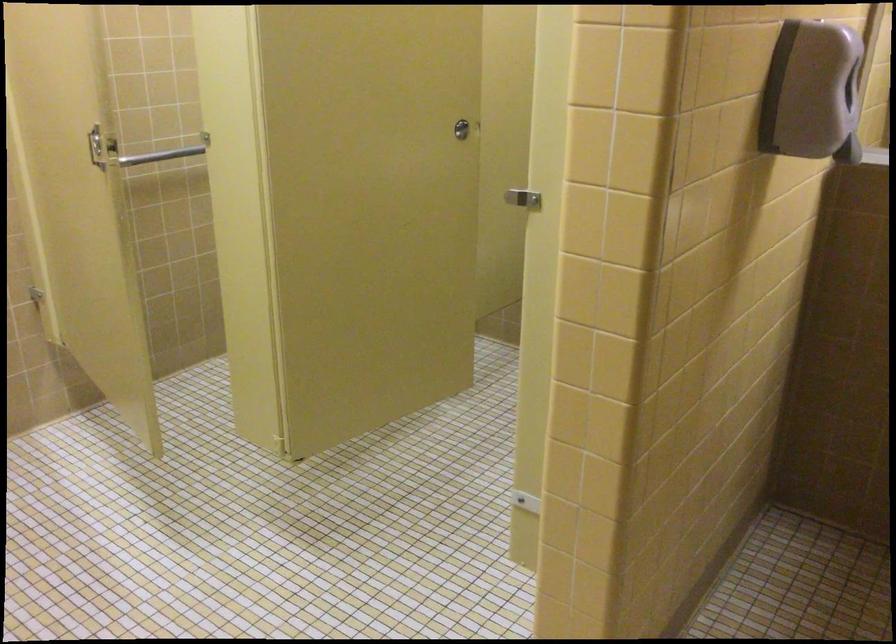
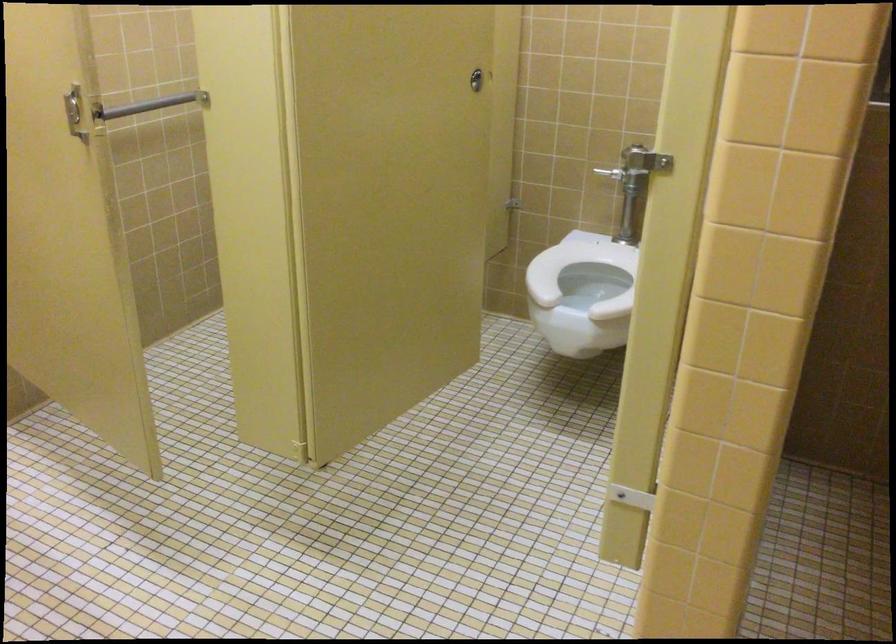
In the second image, find the point that corresponds to [521,204] in the first image.

(644, 160)